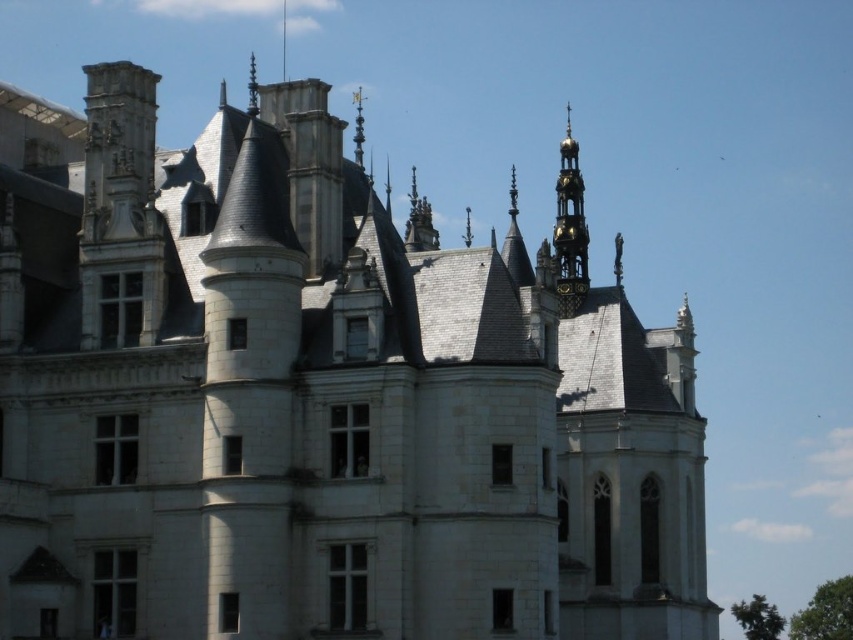
You are an architect examining the castle facade. You notice two spires, the gold plated spire at upper right and the gold polished spire at upper center. Which spire is positioned to the right of the other?

The gold plated spire at upper right is positioned to the right of the gold polished spire at upper center.

You are standing at the base of the castle, and you want to take a photo of the gold polished spire at upper center. If your camera has a maximum zoom range of 100 meters, will you be able to capture the spire clearly?

The gold polished spire at upper center and camera are 86.67 meters apart. Since the camera can zoom up to 100 meters, it is within the maximum range, so yes, you can capture the spire clearly.

You are a drone operator tasked with capturing aerial footage of the castle. Your drone has a maximum flight range of 20 meters. You need to fly from the gold plated spire at upper right to the gold metallic spire at upper center. Can your drone complete this flight without exceeding its range?

The distance between the gold plated spire at upper right and the gold metallic spire at upper center is 21.06 meters, which exceeds the drone operator drone maximum flight range of 20 meters. Therefore, the drone cannot complete this flight without exceeding its range.